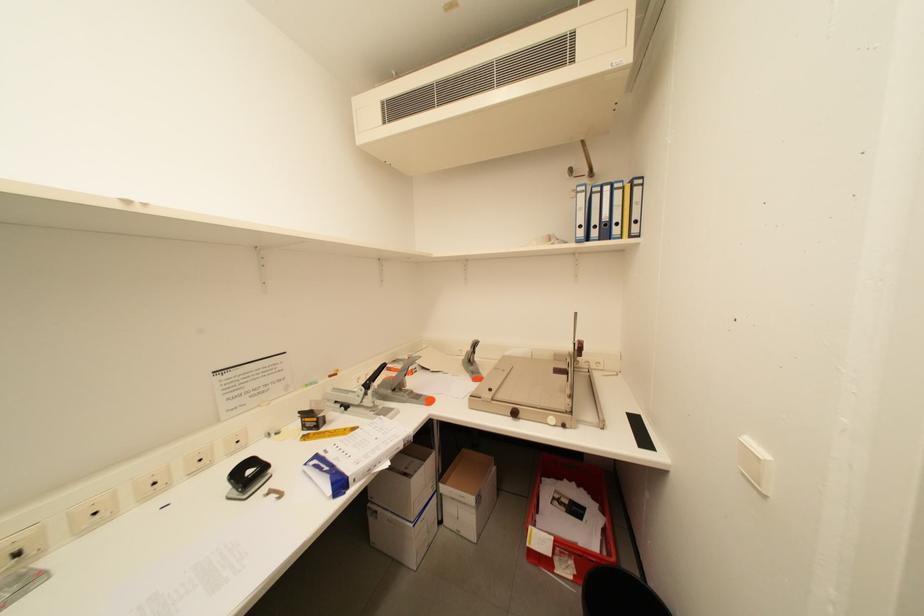
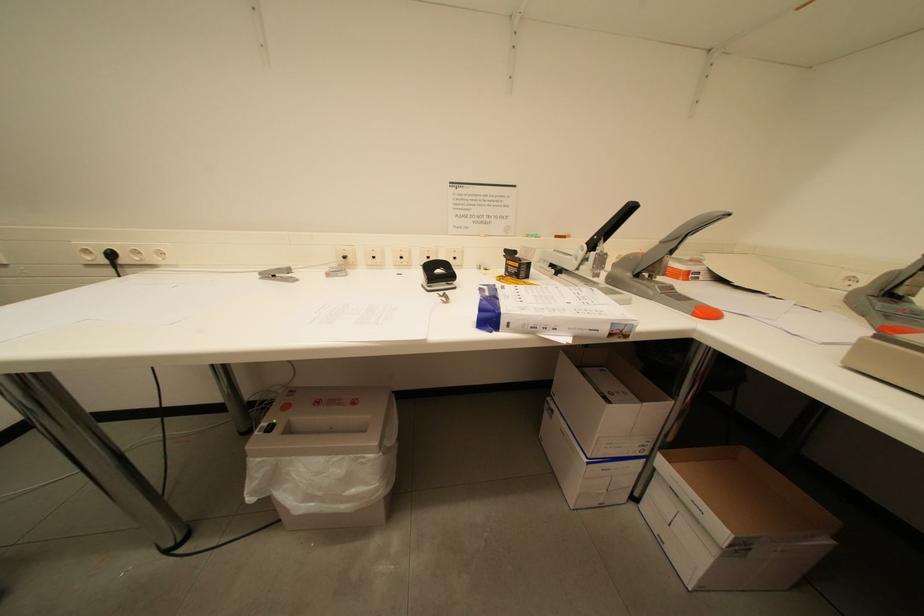
How did the camera likely rotate?

The camera's rotation is toward left-down.